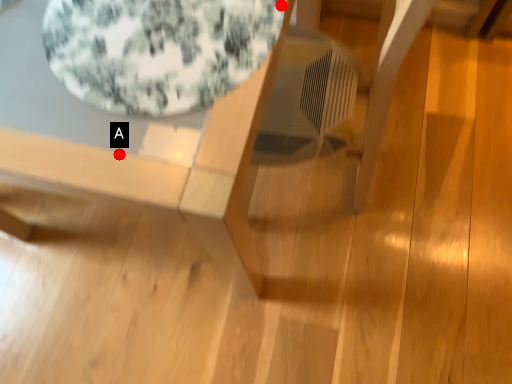
Question: Two points are circled on the image, labeled by A and B beside each circle. Which point is farther from the camera taking this photo?

Choices:
 (A) A is further
 (B) B is further

Answer: (B)